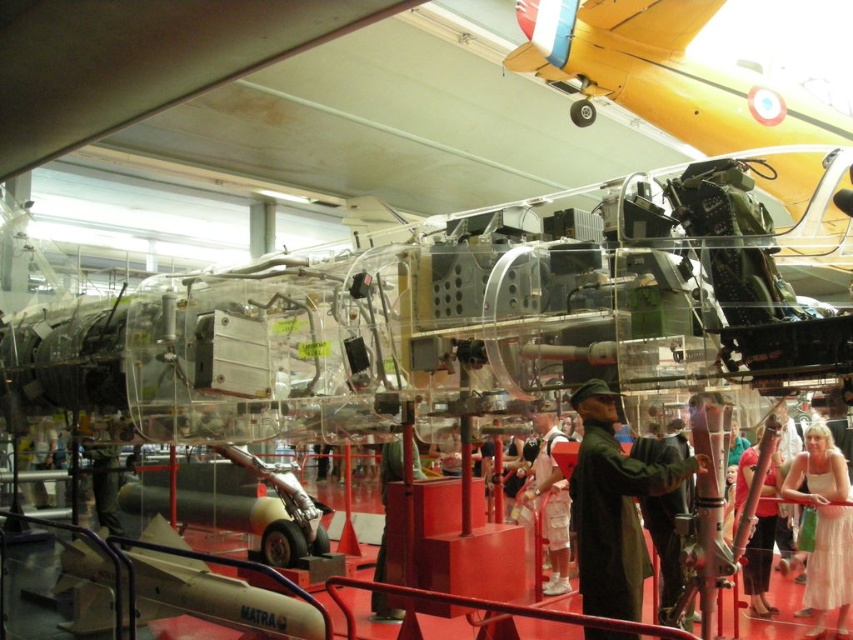
Between metallic green cockpit at center and green matte uniform at center, which one has less height?

With less height is green matte uniform at center.

Does metallic green cockpit at center have a lesser width compared to green matte uniform at center?

Incorrect, metallic green cockpit at center's width is not less than green matte uniform at center's.

The width and height of the screenshot is (853, 640). Describe the element at coordinates (665, 74) in the screenshot. I see `metallic green cockpit at center` at that location.

The height and width of the screenshot is (640, 853). In order to click on metallic green cockpit at center in this screenshot , I will do `click(665, 74)`.

Between point (761, 516) and point (381, 502), which one is positioned in front?

Positioned in front is point (761, 516).

Is light brown wooden pole at lower right positioned before green fabric jacket at center?

No, light brown wooden pole at lower right is behind green fabric jacket at center.

Is point (750, 451) farther from camera compared to point (396, 467)?

Yes, point (750, 451) is farther from viewer.

The image size is (853, 640). What are the coordinates of `light brown wooden pole at lower right` in the screenshot? It's located at (758, 513).

Is green matte uniform at center positioned before white lace dress at center?

Yes.

Between green matte uniform at center and white lace dress at center, which one appears on the right side from the viewer's perspective?

white lace dress at center

Does point (694, 465) come farther from viewer compared to point (822, 618)?

No, (694, 465) is closer to viewer.

You are a GUI agent. You are given a task and a screenshot of the screen. Output one action in this format:
    pyautogui.click(x=<x>, y=<y>)
    Task: Click on the green matte uniform at center
    
    Given the screenshot: What is the action you would take?
    pyautogui.click(x=612, y=508)